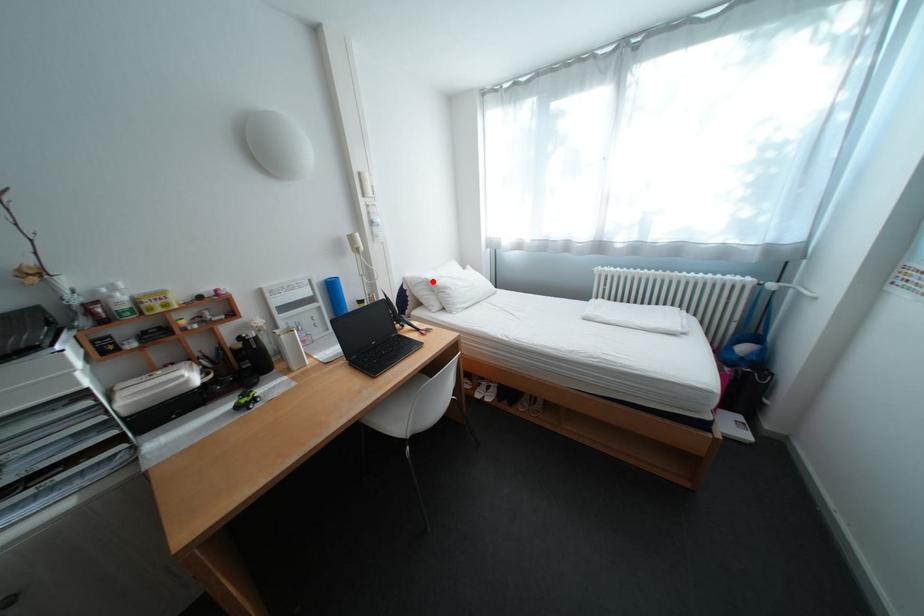
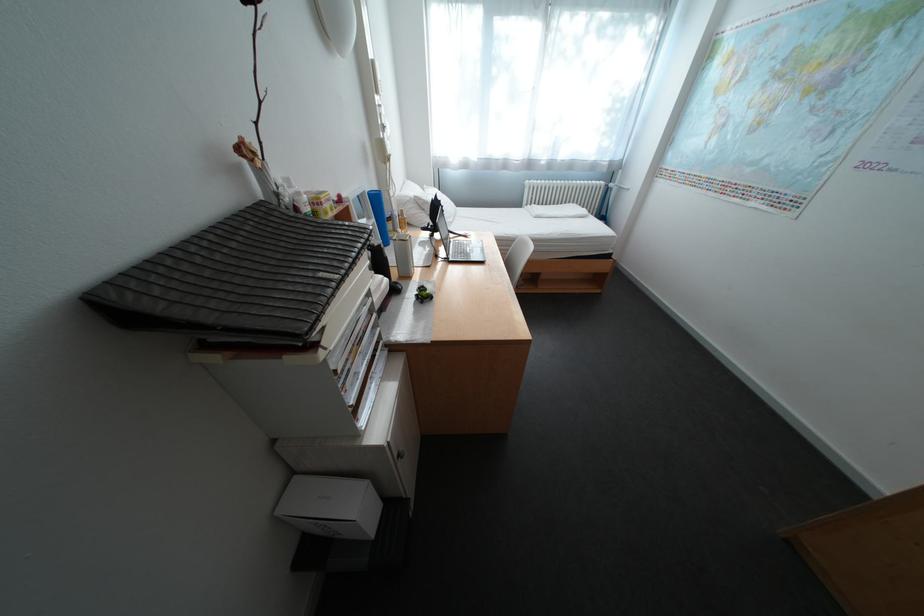
Locate, in the second image, the point that corresponds to the highlighted location in the first image.

(420, 200)